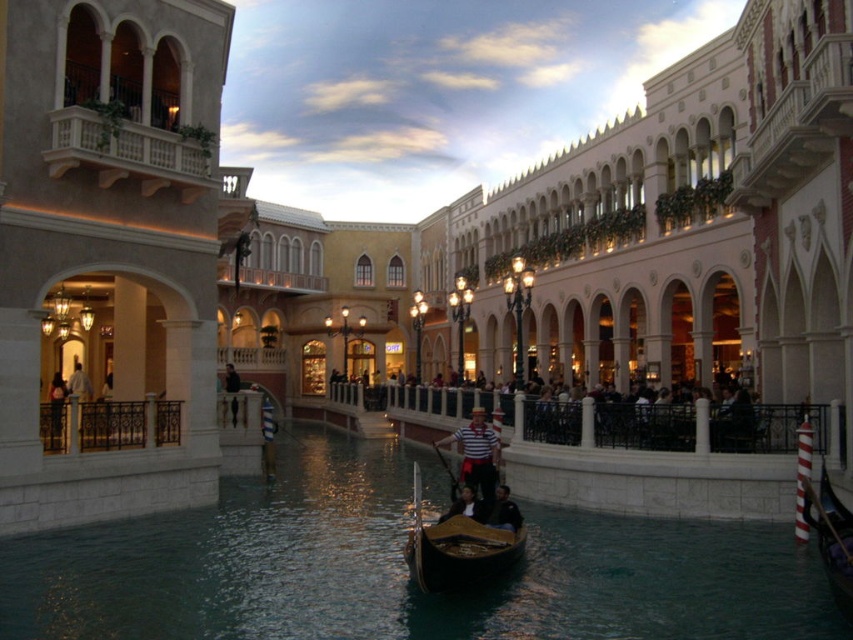
Question: Estimate the real-world distances between objects in this image. Which object is closer to the shiny dark wood gondola at center?

Choices:
 (A) dark brown leather jacket at lower center
 (B) smooth stone balcony at upper left
 (C) striped fabric gondolier at center
 (D) dark blue fabric jacket at center

Answer: (A)

Question: Observing the image, what is the correct spatial positioning of gold polished wood boat at center in reference to dark brown leather jacket at lower center?

Choices:
 (A) above
 (B) below

Answer: (B)

Question: Among these points, which one is farthest from the camera?

Choices:
 (A) (463, 493)
 (B) (474, 458)

Answer: (B)

Question: Does smooth stone balcony at upper left have a lesser width compared to dark blue fabric jacket at center?

Choices:
 (A) no
 (B) yes

Answer: (A)

Question: Which object appears closest to the camera in this image?

Choices:
 (A) striped fabric gondolier at center
 (B) gold polished wood boat at center
 (C) smooth stone balcony at upper left
 (D) shiny dark wood gondola at center

Answer: (D)

Question: Does gold polished wood boat at center appear under dark blue fabric jacket at center?

Choices:
 (A) yes
 (B) no

Answer: (A)